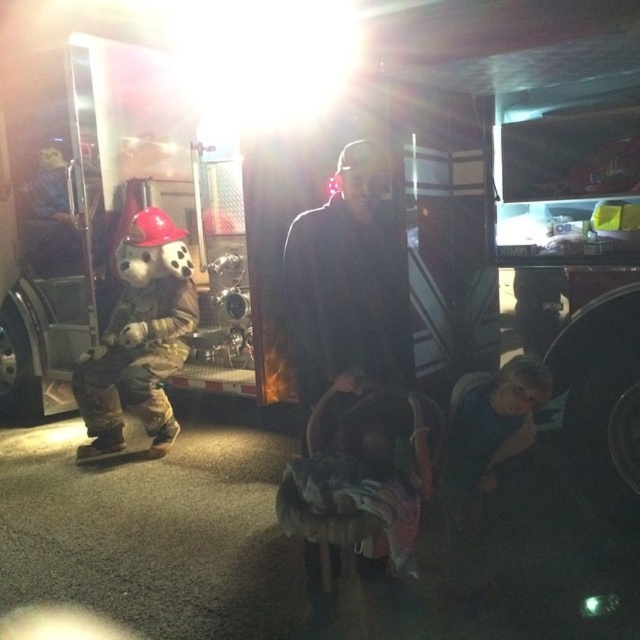
You are a photographer trying to capture the scene of the nighttime fire truck setup. You notice two fabrics in the image, the dark blue fabric at center and the camouflage fabric costume at left. Which fabric would you need to adjust your camera settings for to ensure proper exposure, considering their size in the frame?

The camouflage fabric costume at left occupies more space in the frame than the dark blue fabric at center, so adjusting the camera settings for the camouflage fabric costume at left would better account for the larger area it covers.

You are a firefighter standing near the fire truck. You need to quickly retrieve an extinguisher located inside the fire truck. The extinguisher is stored behind the dark fabric baby carriage at center. Can you reach it without moving the carriage?

The dark fabric baby carriage at center is 2.19 meters away from you. Since it is positioned at center and the extinguisher is behind it, you would need to move the carriage to access the extinguisher.

You are a photographer trying to capture a clear photo of both the dark fabric baby carriage at center and the camouflage fabric costume at left. Since the fire truck is brightly lit and the surroundings are dark, which object might appear more in focus in your photo?

The dark fabric baby carriage at center is in front of the camouflage fabric costume at left, so the baby carriage will likely be more in focus as it is closer to the camera.